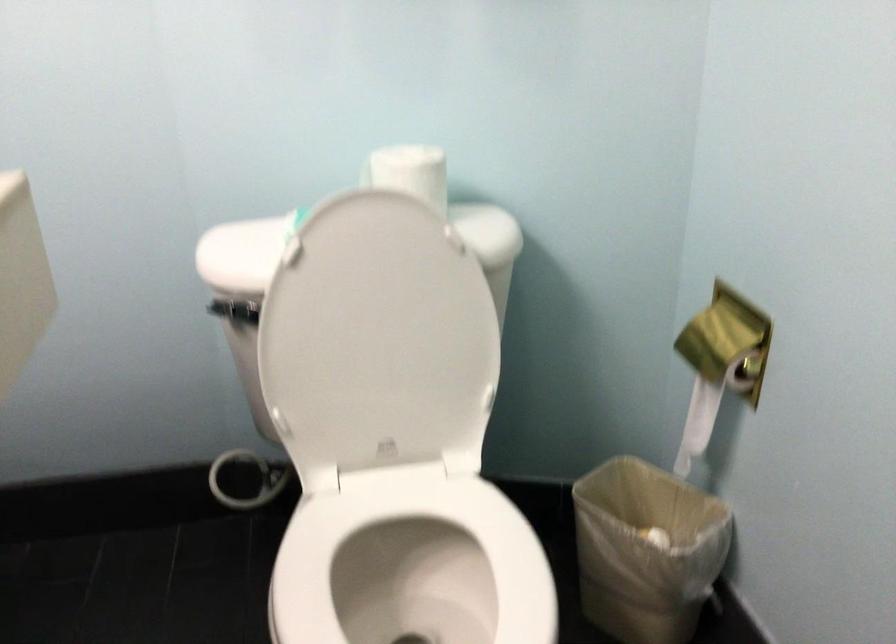
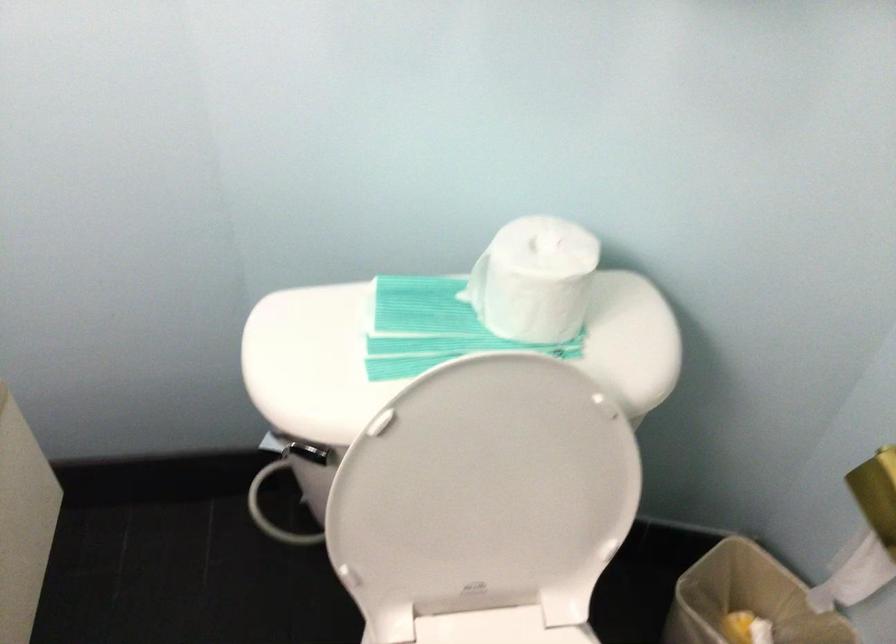
Locate, in the second image, the point that corresponds to point 394,167 in the first image.

(535, 279)